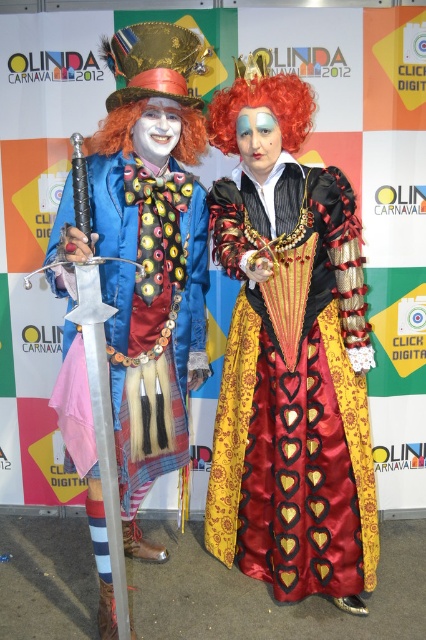
Question: Among these objects, which one is nearest to the camera?

Choices:
 (A) silver metallic sword at center
 (B) silky satin dress at center

Answer: (A)

Question: Can you confirm if shiny blue fabric coat at center is positioned below matte red wig at center?

Choices:
 (A) no
 (B) yes

Answer: (B)

Question: Does red curly wig at upper right appear on the left side of white matte face at center?

Choices:
 (A) yes
 (B) no

Answer: (B)

Question: Among these points, which one is farthest from the camera?

Choices:
 (A) (279, 125)
 (B) (354, 282)

Answer: (B)

Question: Among these objects, which one is farthest from the camera?

Choices:
 (A) matte red wig at center
 (B) shiny blue fabric coat at center
 (C) silky satin dress at center

Answer: (A)

Question: From the image, what is the correct spatial relationship of shiny blue fabric coat at center in relation to matte red wig at center?

Choices:
 (A) right
 (B) left

Answer: (B)